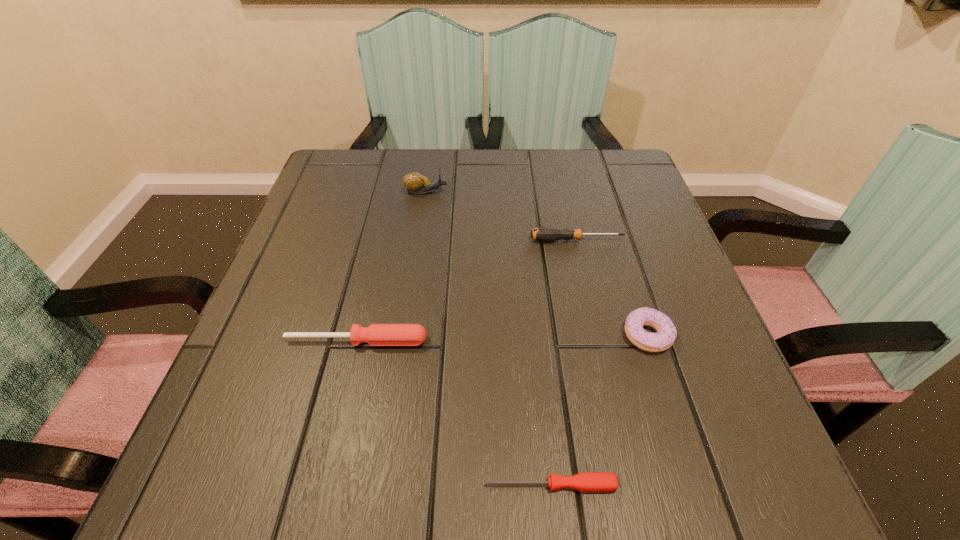
Where is `the farthest object`? Image resolution: width=960 pixels, height=540 pixels. the farthest object is located at coordinates (415, 183).

The height and width of the screenshot is (540, 960). What are the coordinates of `the tallest object` in the screenshot? It's located at (415, 183).

The width and height of the screenshot is (960, 540). I want to click on doughnut, so click(666, 334).

Find the location of `the second nearest screwdriver`. the second nearest screwdriver is located at coordinates (376, 334).

This screenshot has height=540, width=960. What are the coordinates of `the fourth nearest object` in the screenshot? It's located at (546, 234).

Locate an element on the screen. the nearest object is located at coordinates (593, 482).

At what (x,y) coordinates should I click in order to perform the action: click on the nearest screwdriver. Please return your answer as a coordinate pair (x, y). Looking at the image, I should click on (593, 482).

Locate an element on the screen. The width and height of the screenshot is (960, 540). free space located 0.320m on the front-facing side of the escargot is located at coordinates (585, 192).

Identify the location of vacant area situated on the back of the doughnut. This screenshot has height=540, width=960. (607, 210).

This screenshot has width=960, height=540. Find the location of `vacant space located on the back of the second farthest screwdriver`. vacant space located on the back of the second farthest screwdriver is located at coordinates (380, 241).